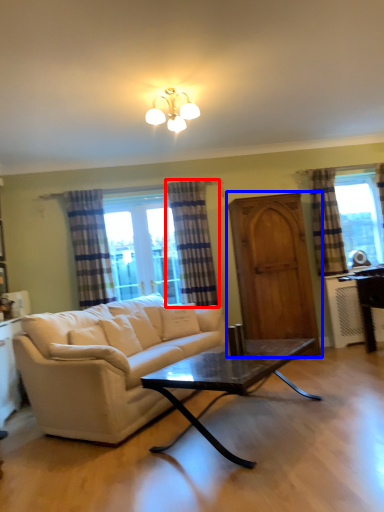
Question: Among these objects, which one is nearest to the camera, curtain (highlighted by a red box) or screen door (highlighted by a blue box)?

Choices:
 (A) curtain
 (B) screen door

Answer: (B)